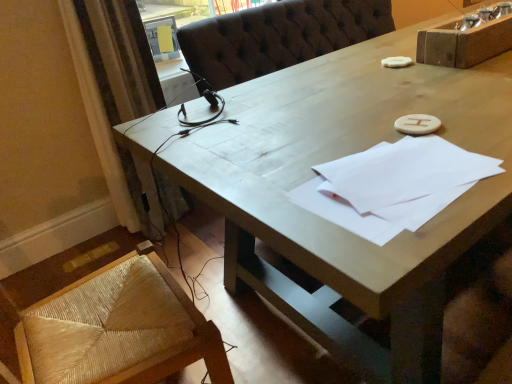
What do you see at coordinates (393, 185) in the screenshot?
I see `white paper at center` at bounding box center [393, 185].

Measure the distance between white paper at center and camera.

white paper at center and camera are 66.00 centimeters apart from each other.

You are a GUI agent. You are given a task and a screenshot of the screen. Output one action in this format:
    pyautogui.click(x=<x>, y=<y>)
    Task: Click on the white paper at center
    This screenshot has width=512, height=384.
    Given the screenshot: What is the action you would take?
    pyautogui.click(x=393, y=185)

The image size is (512, 384). Find the location of `beige textured curtain at left`. beige textured curtain at left is located at coordinates click(117, 95).

What do you see at coordinates (117, 95) in the screenshot?
I see `beige textured curtain at left` at bounding box center [117, 95].

The height and width of the screenshot is (384, 512). What are the coordinates of `white paper at center` in the screenshot? It's located at [x=393, y=185].

Is beige textured curtain at left to the right of white paper at center from the viewer's perspective?

In fact, beige textured curtain at left is to the left of white paper at center.

Which object is closer to the camera taking this photo, beige textured curtain at left or white paper at center?

white paper at center is closer to the camera.

Does point (102, 55) lie in front of point (422, 177)?

No, (102, 55) is further to viewer.

From the picture: From the image's perspective, which is below, beige textured curtain at left or white paper at center?

From the image's view, white paper at center is below.

From a real-world perspective, is beige textured curtain at left on white paper at center?

No, from a real-world perspective, beige textured curtain at left is not on top of white paper at center.

Which object is thinner, beige textured curtain at left or white paper at center?

white paper at center is thinner.

Based on the photo, considering the sizes of beige textured curtain at left and white paper at center in the image, is beige textured curtain at left taller or shorter than white paper at center?

Clearly, beige textured curtain at left is taller compared to white paper at center.

Considering the sizes of objects beige textured curtain at left and white paper at center in the image provided, who is bigger, beige textured curtain at left or white paper at center?

beige textured curtain at left.

Can we say beige textured curtain at left lies outside white paper at center?

Yes.

Are beige textured curtain at left and white paper at center located far from each other?

Indeed, beige textured curtain at left is not near white paper at center.

Is beige textured curtain at left positioned with its back to white paper at center?

No, beige textured curtain at left's orientation is not away from white paper at center.

How many degrees apart are the facing directions of beige textured curtain at left and white paper at center?

7.6 degrees separate the facing orientations of beige textured curtain at left and white paper at center.

You are a GUI agent. You are given a task and a screenshot of the screen. Output one action in this format:
    pyautogui.click(x=<x>, y=<y>)
    Task: Click on the notepad in front of the beige textured curtain at left
    Image resolution: width=512 pixels, height=384 pixels.
    Given the screenshot: What is the action you would take?
    pyautogui.click(x=393, y=185)

Which is more to the right, white paper at center or beige textured curtain at left?

From the viewer's perspective, white paper at center appears more on the right side.

Which is behind, white paper at center or beige textured curtain at left?

beige textured curtain at left is further from the camera.

Does point (440, 173) come closer to viewer compared to point (140, 19)?

Yes, it is in front of point (140, 19).

From the image's perspective, which one is positioned higher, white paper at center or beige textured curtain at left?

beige textured curtain at left appears higher in the image.

From a real-world perspective, relative to beige textured curtain at left, is white paper at center vertically above or below?

white paper at center is above beige textured curtain at left.

Between white paper at center and beige textured curtain at left, which one has larger width?

Wider between the two is beige textured curtain at left.

Considering the relative sizes of white paper at center and beige textured curtain at left in the image provided, is white paper at center shorter than beige textured curtain at left?

Yes.

Does white paper at center have a smaller size compared to beige textured curtain at left?

Yes.

Is white paper at center positioned beyond the bounds of beige textured curtain at left?

Indeed, white paper at center is completely outside beige textured curtain at left.

Is white paper at center next to beige textured curtain at left and touching it?

No, white paper at center is not with beige textured curtain at left.

Is white paper at center oriented towards beige textured curtain at left?

No, white paper at center does not turn towards beige textured curtain at left.

Locate an element on the screen. This screenshot has width=512, height=384. curtain on the left of white paper at center is located at coordinates (117, 95).

Find the location of `curtain that appears below the white paper at center (from a real-world perspective)`. curtain that appears below the white paper at center (from a real-world perspective) is located at coordinates [x=117, y=95].

Find the location of a particular element. The image size is (512, 384). notepad that appears above the beige textured curtain at left (from a real-world perspective) is located at coordinates coord(393,185).